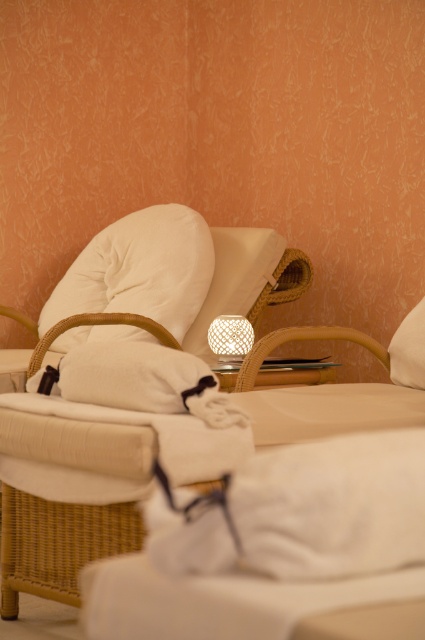
Does woven wood armchair at left have a lesser height compared to white soft blanket at lower center?

No, woven wood armchair at left is not shorter than white soft blanket at lower center.

Measure the distance between woven wood armchair at left and camera.

woven wood armchair at left and camera are 8.69 feet apart from each other.

Find the location of a particular element. woven wood armchair at left is located at coordinates (127, 397).

Is white soft pillow at upper left positioned behind woven bamboo lamp at center?

Yes.

Is point (124, 308) positioned in front of point (246, 326)?

No, (124, 308) is behind (246, 326).

What are the coordinates of `white soft pillow at upper left` in the screenshot? It's located at (139, 269).

Which of these two, white soft bed at center or woven bamboo lamp at center, stands shorter?

With less height is woven bamboo lamp at center.

Is point (283, 486) positioned before point (224, 326)?

That is True.

Who is more distant from viewer, (294, 461) or (248, 342)?

The point (248, 342) is more distant.

Find the location of a particular element. white soft bed at center is located at coordinates (274, 545).